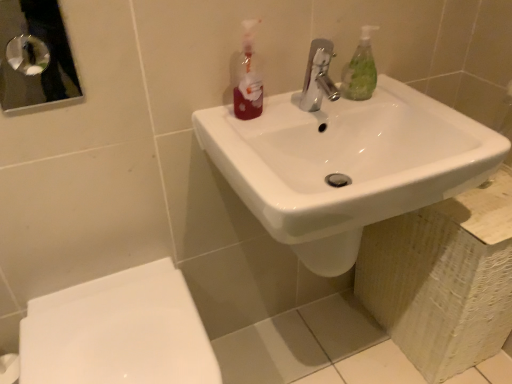
Question: Is green translucent soap dispenser at upper right bigger than polished chrome faucet at center?

Choices:
 (A) yes
 (B) no

Answer: (B)

Question: Would you say green translucent soap dispenser at upper right is outside polished chrome faucet at center?

Choices:
 (A) no
 (B) yes

Answer: (B)

Question: From a real-world perspective, does green translucent soap dispenser at upper right stand above polished chrome faucet at center?

Choices:
 (A) no
 (B) yes

Answer: (B)

Question: Is polished chrome faucet at center inside green translucent soap dispenser at upper right?

Choices:
 (A) yes
 (B) no

Answer: (B)

Question: Are green translucent soap dispenser at upper right and polished chrome faucet at center beside each other?

Choices:
 (A) no
 (B) yes

Answer: (B)

Question: Looking at their shapes, would you say polished chrome faucet at center is wider or thinner than white glossy sink at center?

Choices:
 (A) thin
 (B) wide

Answer: (A)

Question: Is polished chrome faucet at center inside the boundaries of white glossy sink at center, or outside?

Choices:
 (A) inside
 (B) outside

Answer: (B)

Question: In terms of height, does polished chrome faucet at center look taller or shorter compared to white glossy sink at center?

Choices:
 (A) short
 (B) tall

Answer: (A)

Question: Considering the positions of point (311, 91) and point (399, 134), is point (311, 91) closer or farther from the camera than point (399, 134)?

Choices:
 (A) closer
 (B) farther

Answer: (B)

Question: In the image, is translucent plastic bottle at upper center on the left side or the right side of white glossy sink at center?

Choices:
 (A) left
 (B) right

Answer: (A)

Question: Is translucent plastic bottle at upper center wider or thinner than white glossy sink at center?

Choices:
 (A) thin
 (B) wide

Answer: (A)

Question: From a real-world perspective, is translucent plastic bottle at upper center above or below white glossy sink at center?

Choices:
 (A) above
 (B) below

Answer: (A)

Question: Based on their sizes in the image, would you say translucent plastic bottle at upper center is bigger or smaller than white glossy sink at center?

Choices:
 (A) big
 (B) small

Answer: (B)

Question: Considering the positions of point (x=236, y=89) and point (x=114, y=347), is point (x=236, y=89) closer or farther from the camera than point (x=114, y=347)?

Choices:
 (A) closer
 (B) farther

Answer: (B)

Question: Is translucent plastic bottle at upper center wider or thinner than white glossy toilet at lower left?

Choices:
 (A) wide
 (B) thin

Answer: (B)